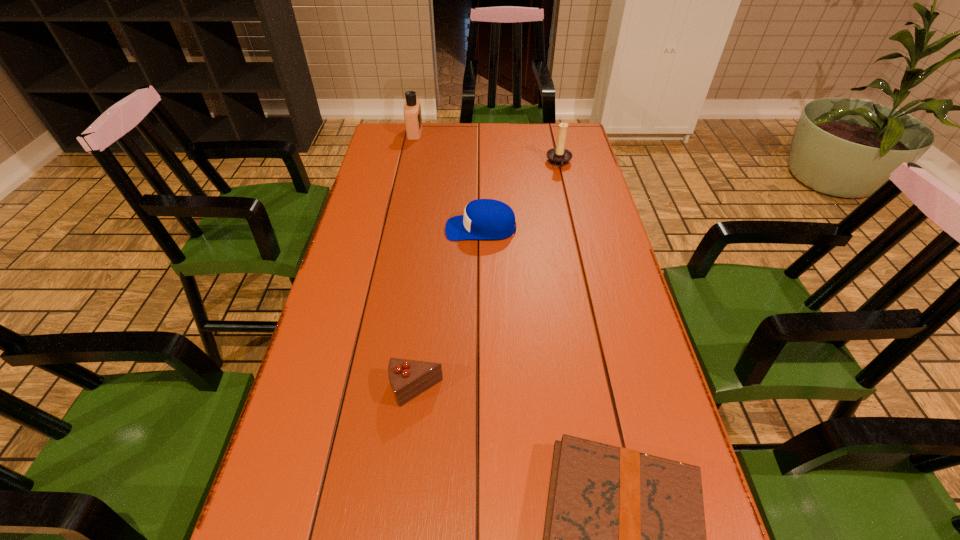
I want to click on free location located on the front-facing side of the third nearest object, so click(x=358, y=228).

This screenshot has width=960, height=540. What are the coordinates of `vacant space located on the front-facing side of the third nearest object` in the screenshot? It's located at click(377, 228).

You are a GUI agent. You are given a task and a screenshot of the screen. Output one action in this format:
    pyautogui.click(x=<x>, y=<y>)
    Task: Click on the free location located on the right of the chocolate cake
    The image size is (960, 540).
    Given the screenshot: What is the action you would take?
    pyautogui.click(x=556, y=390)

What are the coordinates of `object that is positioned at the far edge` in the screenshot? It's located at [x=412, y=109].

Find the location of a particular element. The image size is (960, 540). object that is at the left edge is located at coordinates (412, 109).

Locate an element on the screen. This screenshot has width=960, height=540. object positioned at the right edge is located at coordinates click(558, 156).

Image resolution: width=960 pixels, height=540 pixels. I want to click on object positioned at the far left corner, so click(x=412, y=109).

Where is `vacant space at the far edge of the desktop`? vacant space at the far edge of the desktop is located at coordinates (427, 143).

This screenshot has height=540, width=960. Identify the location of vacant space at the left edge of the desktop. (408, 185).

The width and height of the screenshot is (960, 540). What are the coordinates of `free spot at the right edge of the desktop` in the screenshot? It's located at (588, 222).